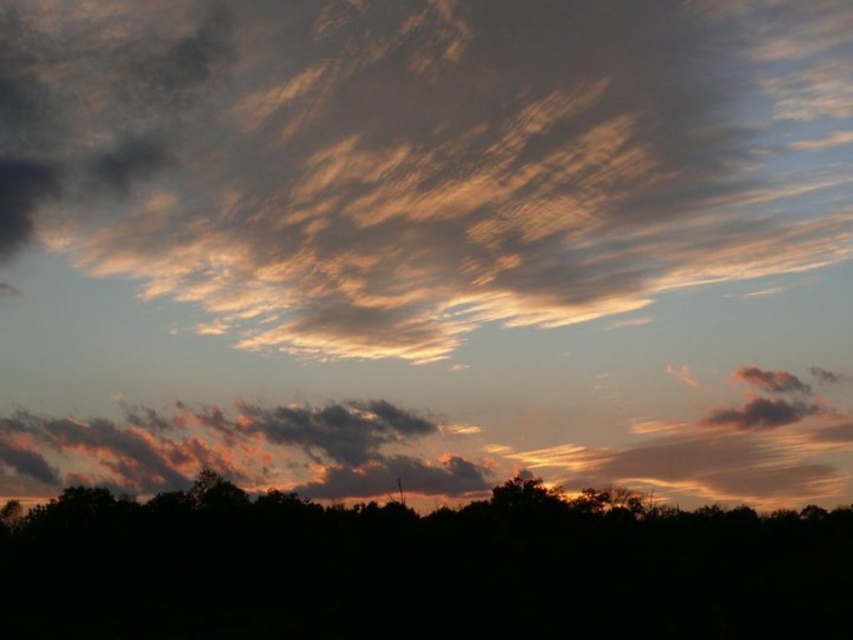
Question: Does golden textured clouds at upper center appear over black matte tree at bottom?

Choices:
 (A) yes
 (B) no

Answer: (A)

Question: Does golden textured clouds at upper center have a smaller size compared to black matte tree at bottom?

Choices:
 (A) no
 (B) yes

Answer: (A)

Question: Which of the following is the closest to the observer?

Choices:
 (A) golden textured clouds at upper center
 (B) black matte tree at bottom

Answer: (B)

Question: Where is golden textured clouds at upper center located in relation to black matte tree at bottom in the image?

Choices:
 (A) above
 (B) below

Answer: (A)